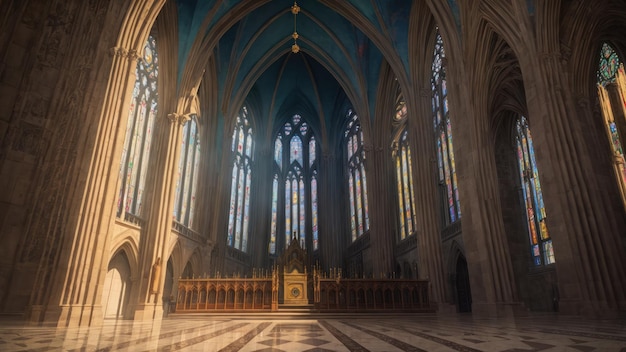
At what (x,y) coordinates should I click in order to perform the action: click on floor. Please return your answer as a coordinate pair (x, y). This screenshot has height=352, width=626. Looking at the image, I should click on (285, 342).